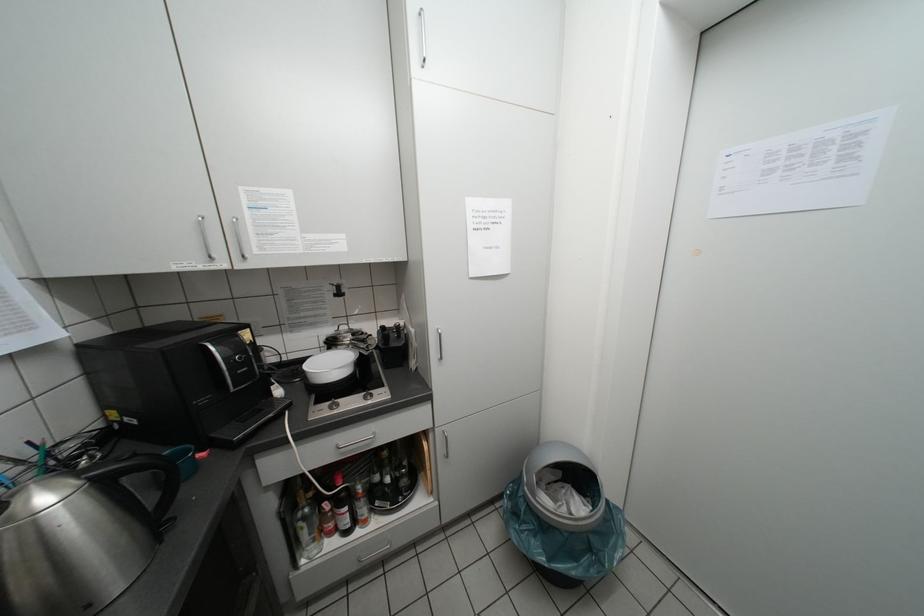
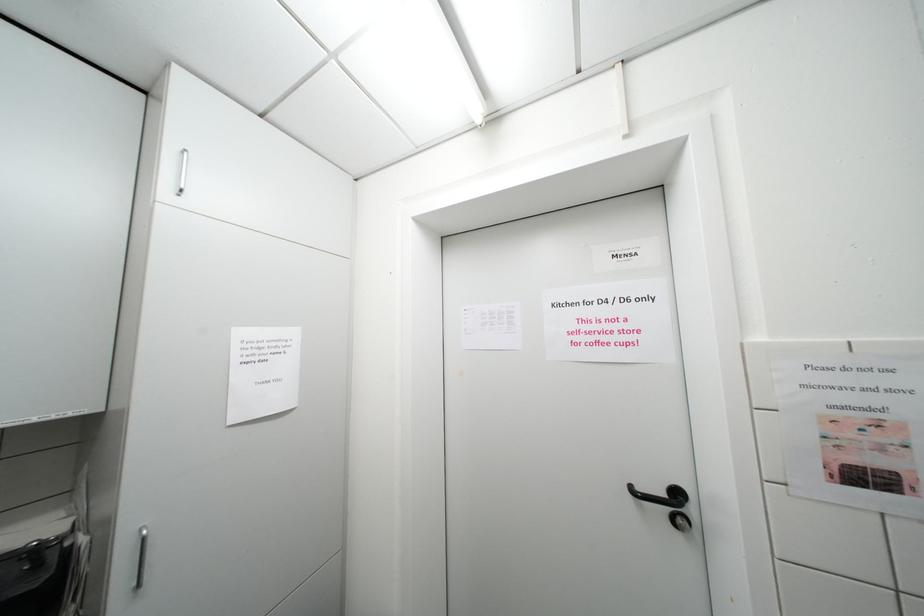
How did the camera likely rotate?

The camera's rotation is toward right-up.